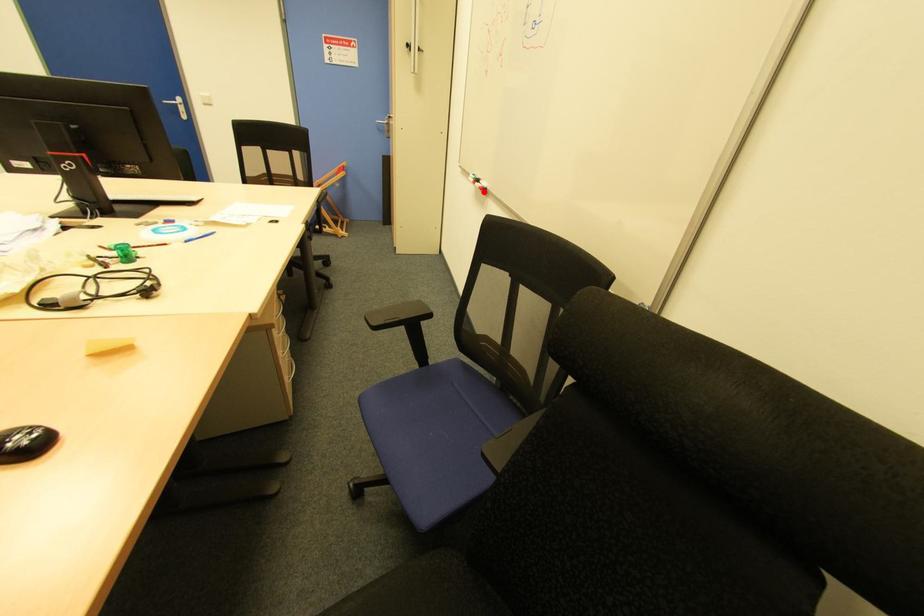
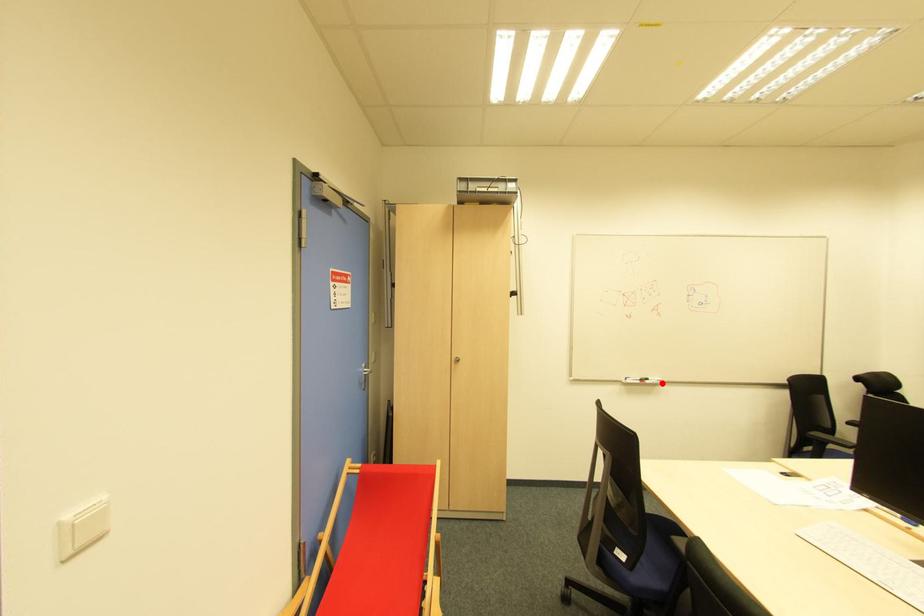
I am providing you with two images of the same scene from different viewpoints. A red point is marked on the first image and another point is marked on the second image. Is the marked point in image1 the same physical position as the marked point in image2?

Yes